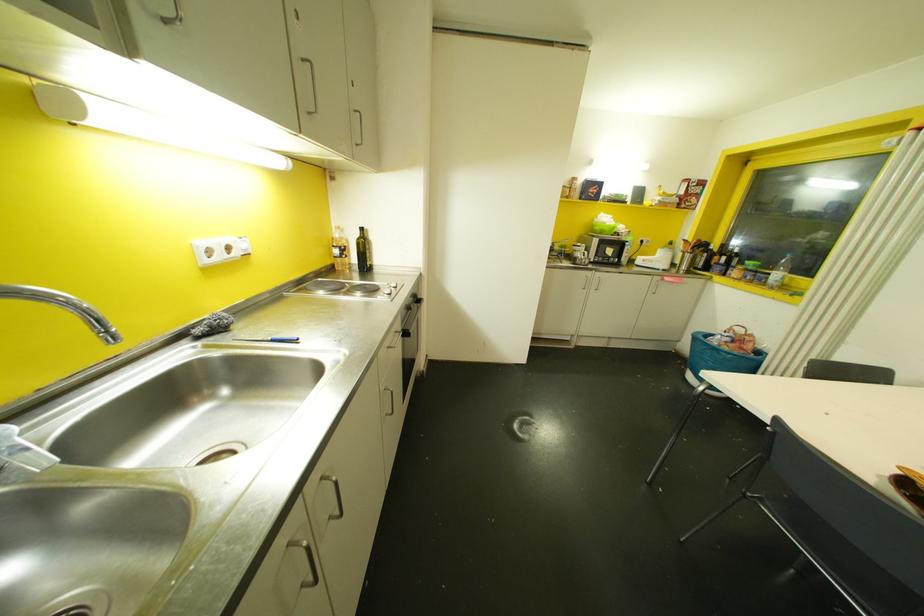
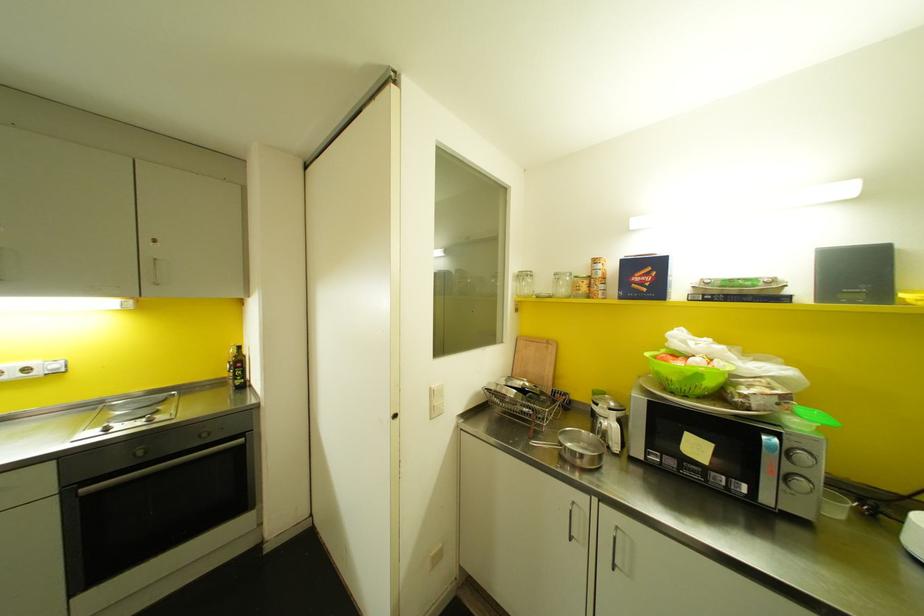
The point at (613,227) is marked in the first image. Where is the corresponding point in the second image?

(698, 376)